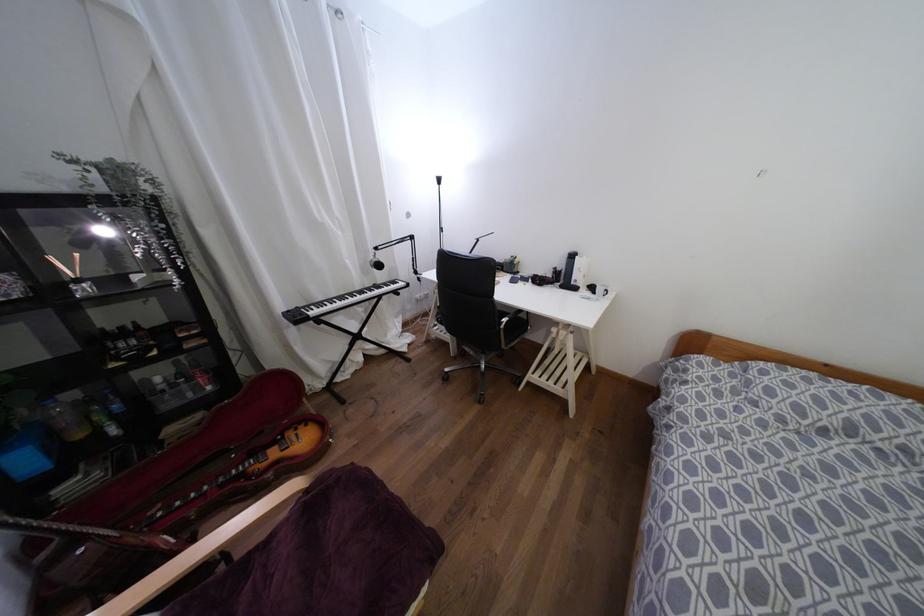
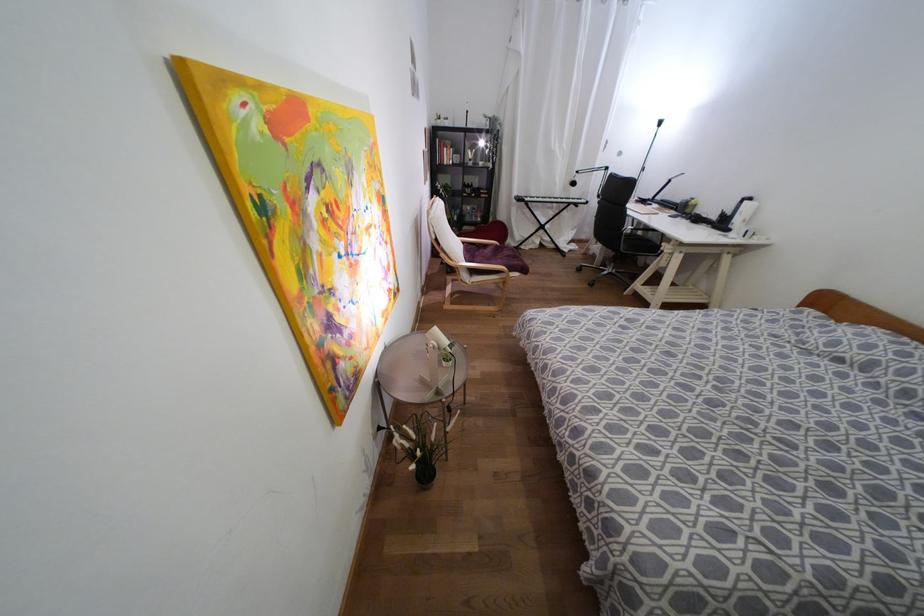
Locate, in the second image, the point that corresponds to [103,231] in the first image.

(480, 143)